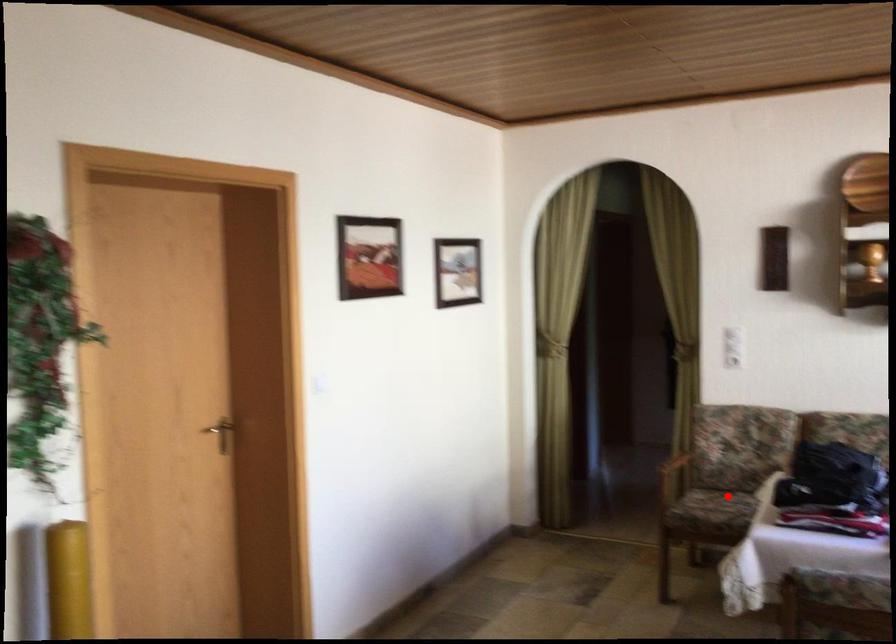
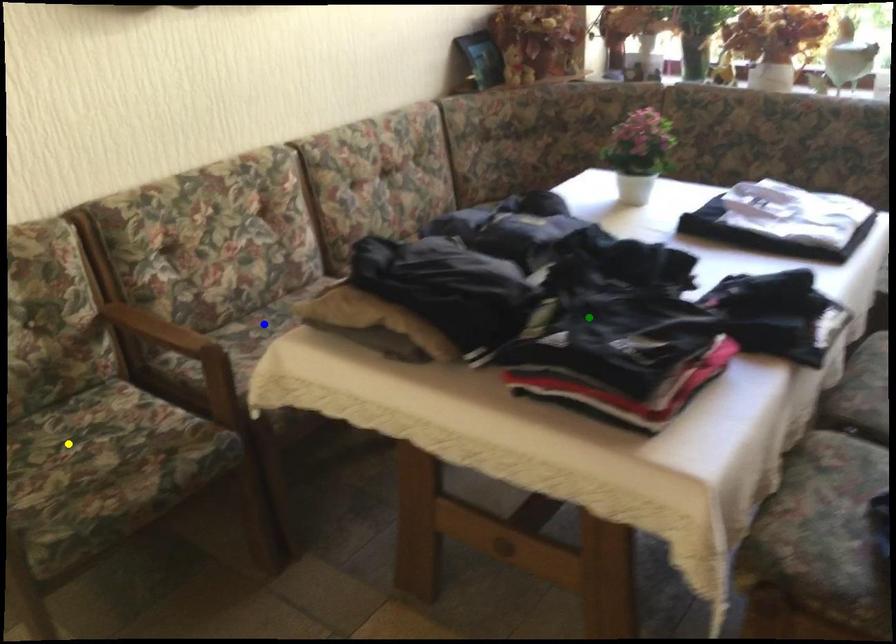
Question: I am providing you with two images of the same scene from different viewpoints. A red point is marked on the first image. You are given multiple points on the second image. Can you choose the point in image 2 that corresponds to the point in image 1?

Choices:
 (A) green point
 (B) blue point
 (C) yellow point

Answer: (C)